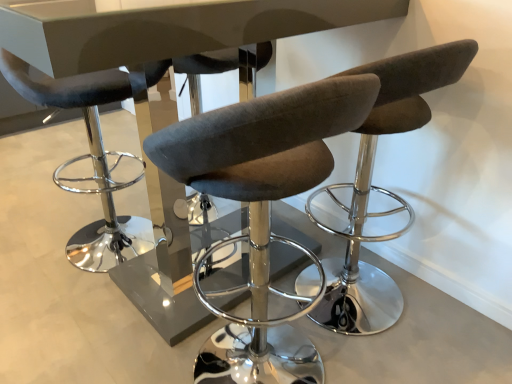
I want to click on matte black stool at left, acting as the second chair starting from the right, so click(89, 158).

Image resolution: width=512 pixels, height=384 pixels. What do you see at coordinates (89, 158) in the screenshot?
I see `matte black stool at left, marked as the first chair in a left-to-right arrangement` at bounding box center [89, 158].

What is the approximate height of brown fabric stool at center, the first chair in the right-to-left sequence?

brown fabric stool at center, the first chair in the right-to-left sequence, is 3.35 feet in height.

I want to click on glossy white table at center, so click(x=164, y=27).

Is glossy white table at center facing towards brown fabric stool at center, which appears as the 2th chair when viewed from the left?

No, glossy white table at center is not facing towards brown fabric stool at center, which appears as the 2th chair when viewed from the left.

Are glossy white table at center and brown fabric stool at center, which appears as the 2th chair when viewed from the left, located far from each other?

No, glossy white table at center is in close proximity to brown fabric stool at center, which appears as the 2th chair when viewed from the left.

Considering the relative positions of glossy white table at center and brown fabric stool at center, the first chair in the right-to-left sequence, in the image provided, is glossy white table at center to the right of brown fabric stool at center, the first chair in the right-to-left sequence, from the viewer's perspective?

No.

What's the angular difference between brown fabric stool at center, the first chair in the right-to-left sequence, and matte black stool at left, acting as the second chair starting from the right,'s facing directions?

180 degrees.

The height and width of the screenshot is (384, 512). Find the location of `chair below the brown fabric stool at center, which appears as the 2th chair when viewed from the left (from a real-world perspective)`. chair below the brown fabric stool at center, which appears as the 2th chair when viewed from the left (from a real-world perspective) is located at coordinates (89, 158).

From a real-world perspective, is brown fabric stool at center, which appears as the 2th chair when viewed from the left, located beneath matte black stool at left, marked as the first chair in a left-to-right arrangement?

No.

Between brown fabric stool at center, the first chair in the right-to-left sequence, and matte black stool at left, marked as the first chair in a left-to-right arrangement, which one has larger width?

brown fabric stool at center, the first chair in the right-to-left sequence, is wider.

How many degrees apart are the facing directions of matte black stool at left, marked as the first chair in a left-to-right arrangement, and brown fabric stool at center, which appears as the 2th chair when viewed from the left?

180 degrees.

Does matte black stool at left, marked as the first chair in a left-to-right arrangement, appear on the left side of brown fabric stool at center, the first chair in the right-to-left sequence?

Indeed, matte black stool at left, marked as the first chair in a left-to-right arrangement, is positioned on the left side of brown fabric stool at center, the first chair in the right-to-left sequence.

In the image, is matte black stool at left, marked as the first chair in a left-to-right arrangement, positioned in front of or behind brown fabric stool at center, the first chair in the right-to-left sequence?

matte black stool at left, marked as the first chair in a left-to-right arrangement, is behind brown fabric stool at center, the first chair in the right-to-left sequence.

In the image, there is a brown fabric stool at center, which appears as the 2th chair when viewed from the left. At what (x,y) coordinates should I click in order to perform the action: click on chair above it (from the image's perspective). Please return your answer as a coordinate pair (x, y). This screenshot has height=384, width=512. Looking at the image, I should click on (89, 158).

Is brown fabric stool at center, the first chair in the right-to-left sequence, wider than glossy white table at center?

No, brown fabric stool at center, the first chair in the right-to-left sequence, is not wider than glossy white table at center.

Does point (331, 228) come in front of point (72, 43)?

No.

Are brown fabric stool at center, the first chair in the right-to-left sequence, and glossy white table at center beside each other?

No, brown fabric stool at center, the first chair in the right-to-left sequence, is not in contact with glossy white table at center.

How many degrees apart are the facing directions of brown fabric stool at center, the first chair in the right-to-left sequence, and glossy white table at center?

The angular difference between brown fabric stool at center, the first chair in the right-to-left sequence, and glossy white table at center is 90 degrees.

From a real-world perspective, is glossy white table at center positioned above or below matte black stool at left, marked as the first chair in a left-to-right arrangement?

Clearly, from a real-world perspective, glossy white table at center is above matte black stool at left, marked as the first chair in a left-to-right arrangement.

Considering the positions of objects glossy white table at center and matte black stool at left, marked as the first chair in a left-to-right arrangement, in the image provided, who is more to the right, glossy white table at center or matte black stool at left, marked as the first chair in a left-to-right arrangement,?

Positioned to the right is glossy white table at center.

From the image's perspective, which object appears higher, glossy white table at center or matte black stool at left, marked as the first chair in a left-to-right arrangement?

matte black stool at left, marked as the first chair in a left-to-right arrangement, is shown above in the image.

Which object is wider, glossy white table at center or matte black stool at left, marked as the first chair in a left-to-right arrangement?

Wider between the two is glossy white table at center.

Is matte black stool at left, acting as the second chair starting from the right, at the right side of glossy white table at center?

No.

Between matte black stool at left, marked as the first chair in a left-to-right arrangement, and glossy white table at center, which one is positioned behind?

matte black stool at left, marked as the first chair in a left-to-right arrangement, is further away from the camera.

Who is bigger, matte black stool at left, acting as the second chair starting from the right, or glossy white table at center?

With larger size is glossy white table at center.

This screenshot has width=512, height=384. What are the coordinates of `table above the brown fabric stool at center, the first chair in the right-to-left sequence (from the image's perspective)` in the screenshot? It's located at (164, 27).

I want to click on chair that is below the matte black stool at left, acting as the second chair starting from the right (from the image's perspective), so click(380, 187).

Based on the photo, estimate the real-world distances between objects in this image. Which object is further from glossy white table at center, brown fabric stool at center, the first chair in the right-to-left sequence, or matte black stool at left, marked as the first chair in a left-to-right arrangement?

The object further to glossy white table at center is matte black stool at left, marked as the first chair in a left-to-right arrangement.

Estimate the real-world distances between objects in this image. Which object is further from glossy white table at center, matte black stool at left, marked as the first chair in a left-to-right arrangement, or brown fabric stool at center, the first chair in the right-to-left sequence?

Based on the image, matte black stool at left, marked as the first chair in a left-to-right arrangement, appears to be further to glossy white table at center.

Considering their positions, is glossy white table at center positioned closer to matte black stool at left, acting as the second chair starting from the right, than brown fabric stool at center, the first chair in the right-to-left sequence?

glossy white table at center is positioned closer to the anchor matte black stool at left, acting as the second chair starting from the right.

From the image, which object appears to be farther from brown fabric stool at center, which appears as the 2th chair when viewed from the left, matte black stool at left, acting as the second chair starting from the right, or glossy white table at center?

matte black stool at left, acting as the second chair starting from the right, is further to brown fabric stool at center, which appears as the 2th chair when viewed from the left.

Looking at the image, which one is located closer to matte black stool at left, acting as the second chair starting from the right, brown fabric stool at center, the first chair in the right-to-left sequence, or glossy white table at center?

The object closer to matte black stool at left, acting as the second chair starting from the right, is glossy white table at center.

Which object lies further to the anchor point brown fabric stool at center, the first chair in the right-to-left sequence, glossy white table at center or matte black stool at left, acting as the second chair starting from the right?

Based on the image, matte black stool at left, acting as the second chair starting from the right, appears to be further to brown fabric stool at center, the first chair in the right-to-left sequence.

Image resolution: width=512 pixels, height=384 pixels. I want to click on table between matte black stool at left, marked as the first chair in a left-to-right arrangement, and brown fabric stool at center, the first chair in the right-to-left sequence, so click(164, 27).